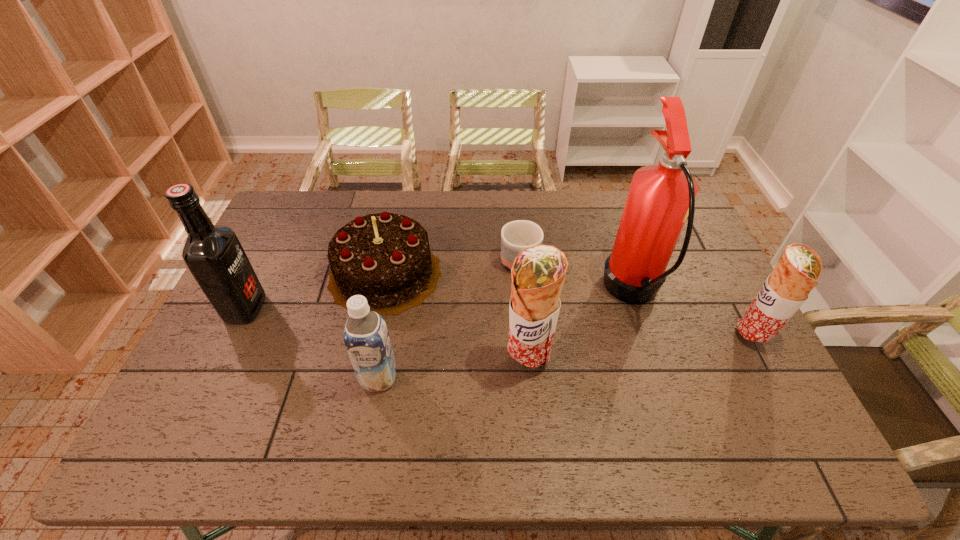
At what (x,y) coordinates should I click in order to perform the action: click on free region at the far edge. Please return your answer as a coordinate pair (x, y). Looking at the image, I should click on (382, 192).

In the image, there is a desktop. Where is `free space at the near edge`? This screenshot has width=960, height=540. free space at the near edge is located at coordinates (684, 401).

This screenshot has height=540, width=960. I want to click on vacant space at the left edge of the desktop, so click(253, 266).

The image size is (960, 540). Find the location of `free space at the right edge of the desktop`. free space at the right edge of the desktop is located at coordinates (696, 267).

Locate an element on the screen. This screenshot has height=540, width=960. vacant space at the near left corner of the desktop is located at coordinates (228, 401).

I want to click on vacant region between the soya milk and the fire extinguisher, so click(506, 335).

At what (x,y) coordinates should I click in order to perform the action: click on free space that is in between the rightmost object and the leftmost object. Please return your answer as a coordinate pair (x, y). Looking at the image, I should click on (499, 323).

Identify the location of vacant space that's between the mug and the soya milk. The width and height of the screenshot is (960, 540). (449, 322).

Where is `free space that is in between the rightmost object and the tallest object`? This screenshot has height=540, width=960. free space that is in between the rightmost object and the tallest object is located at coordinates (692, 315).

You are a GUI agent. You are given a task and a screenshot of the screen. Output one action in this format:
    pyautogui.click(x=<x>, y=<y>)
    Task: Click on the blank region between the tallest object and the right burrito
    Image resolution: width=960 pixels, height=540 pixels.
    Given the screenshot: What is the action you would take?
    pyautogui.click(x=692, y=315)